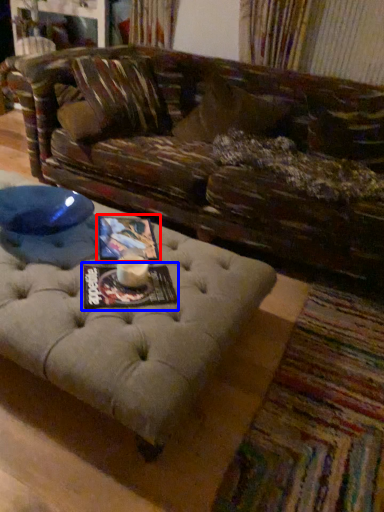
Question: Among these objects, which one is nearest to the camera, magazine (highlighted by a red box) or magazine (highlighted by a blue box)?

Choices:
 (A) magazine
 (B) magazine

Answer: (B)